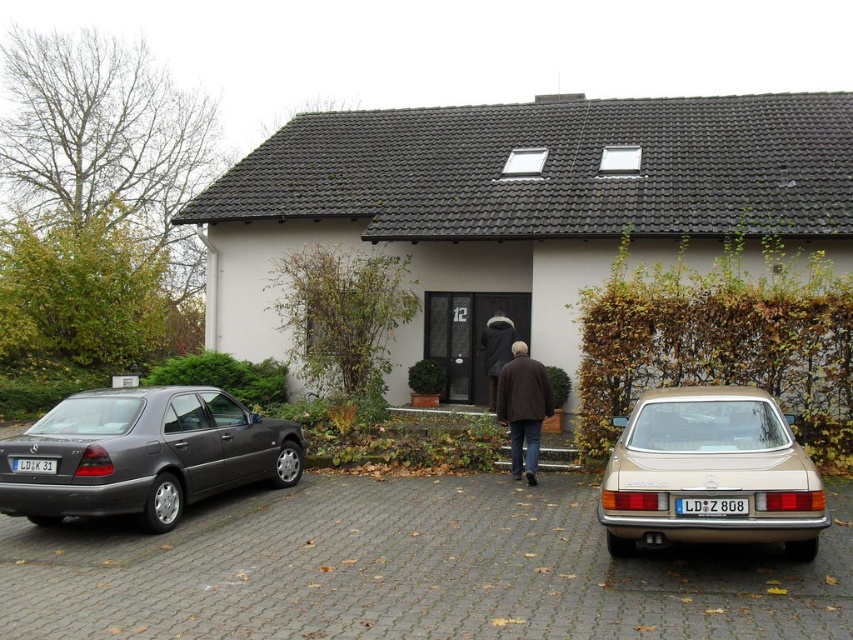
Question: Which of these objects is positioned farthest from the metallic gray sedan at left?

Choices:
 (A) dark brown leather coat at center
 (B) gold metallic car at lower right
 (C) black plastic license plate at lower left

Answer: (A)

Question: Among these points, which one is farthest from the camera?

Choices:
 (A) (682, 502)
 (B) (189, 458)

Answer: (B)

Question: Among these objects, which one is nearest to the camera?

Choices:
 (A) brown wool coat at center
 (B) metallic gray sedan at left
 (C) gray cobblestone driveway at center
 (D) black plastic license plate at lower left

Answer: (C)

Question: Is brown wool coat at center wider than dark brown leather coat at center?

Choices:
 (A) yes
 (B) no

Answer: (A)

Question: Is gray cobblestone driveway at center positioned behind dark brown leather coat at center?

Choices:
 (A) no
 (B) yes

Answer: (A)

Question: Considering the relative positions of brown wool coat at center and blue plastic license plate at center in the image provided, where is brown wool coat at center located with respect to blue plastic license plate at center?

Choices:
 (A) right
 (B) left

Answer: (B)